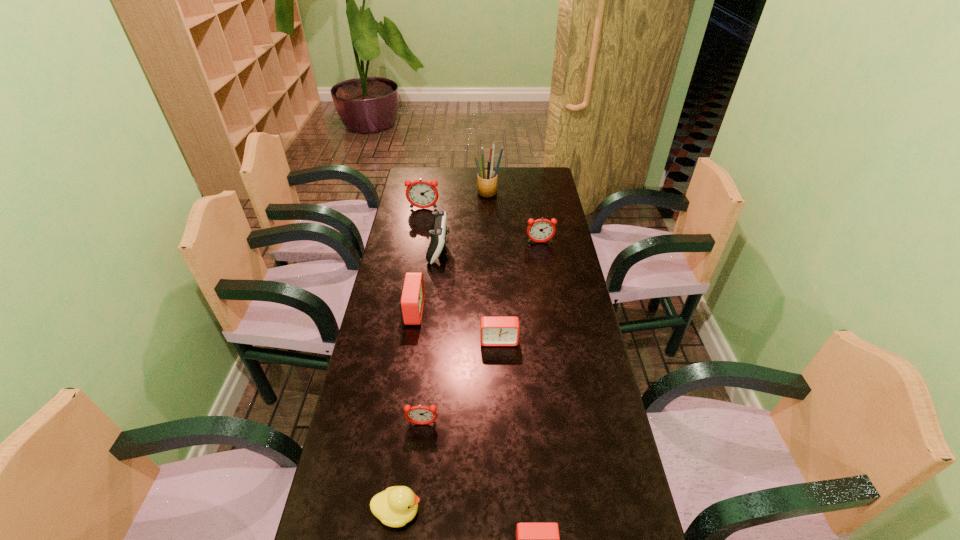
The image size is (960, 540). Find the location of `free spot between the second farthest reddish-pink alarm clock and the control`. free spot between the second farthest reddish-pink alarm clock and the control is located at coordinates (490, 246).

Image resolution: width=960 pixels, height=540 pixels. I want to click on free space between the control and the smallest reddish-pink alarm clock, so click(431, 336).

Find the location of a particular element. This screenshot has width=960, height=540. free spot between the control and the fourth nearest alarm clock is located at coordinates (426, 280).

Locate an element on the screen. The image size is (960, 540). free space between the rightmost reddish-pink alarm clock and the farthest alarm clock is located at coordinates [x=482, y=226].

Find the location of a particular element. The height and width of the screenshot is (540, 960). vacant area that lies between the control and the duckling is located at coordinates (419, 380).

I want to click on free space between the rightmost alarm clock and the control, so click(x=490, y=246).

At what (x,y) coordinates should I click in order to perform the action: click on vacant area that lies between the farthest alarm clock and the tallest object. Please return your answer as a coordinate pair (x, y). Looking at the image, I should click on (456, 201).

I want to click on free space between the biggest red alarm clock and the biggest reddish-pink alarm clock, so click(419, 260).

Identify the location of object that can be found as the fourth closest to the sixth farthest object. (397, 505).

Identify the location of object that is the third closest to the second farthest object. (541, 230).